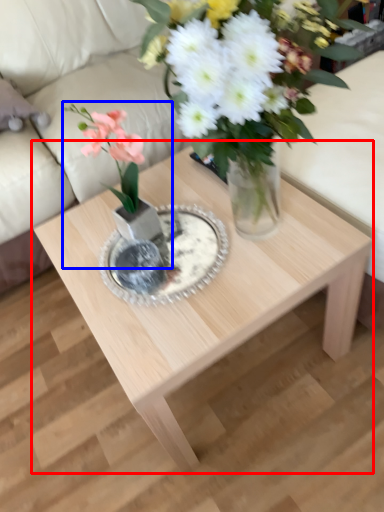
Question: Which object appears farthest to the camera in this image, coffee table (highlighted by a red box) or houseplant (highlighted by a blue box)?

Choices:
 (A) coffee table
 (B) houseplant

Answer: (B)